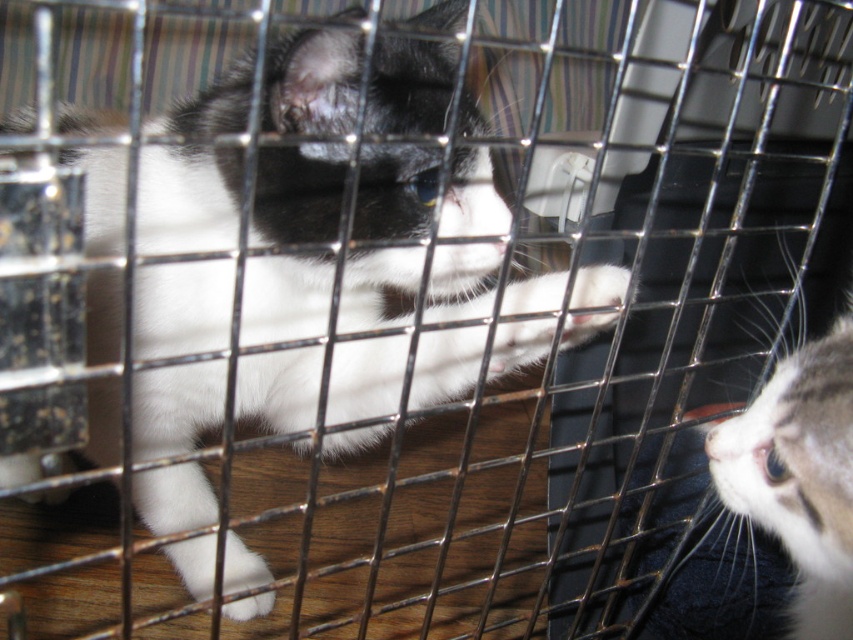
Question: Which point is farther from the camera taking this photo?

Choices:
 (A) (103, 209)
 (B) (801, 538)

Answer: (A)

Question: Is soft fur cat at center above white fur cat at right?

Choices:
 (A) no
 (B) yes

Answer: (B)

Question: Considering the relative positions of soft fur cat at center and white fur cat at right in the image provided, where is soft fur cat at center located with respect to white fur cat at right?

Choices:
 (A) below
 (B) above

Answer: (B)

Question: Among these objects, which one is nearest to the camera?

Choices:
 (A) soft fur cat at center
 (B) white fur cat at right

Answer: (A)

Question: Is soft fur cat at center smaller than white fur cat at right?

Choices:
 (A) yes
 (B) no

Answer: (B)

Question: Among these objects, which one is nearest to the camera?

Choices:
 (A) soft fur cat at center
 (B) white fur cat at right

Answer: (A)